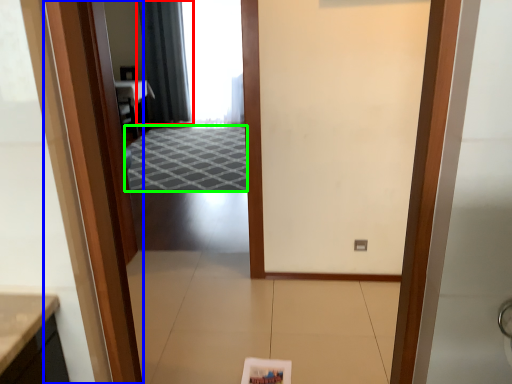
Question: Based on their relative distances, which object is nearer to curtain (highlighted by a red box)? Choose from door (highlighted by a blue box) and doormat (highlighted by a green box).

Choices:
 (A) door
 (B) doormat

Answer: (B)